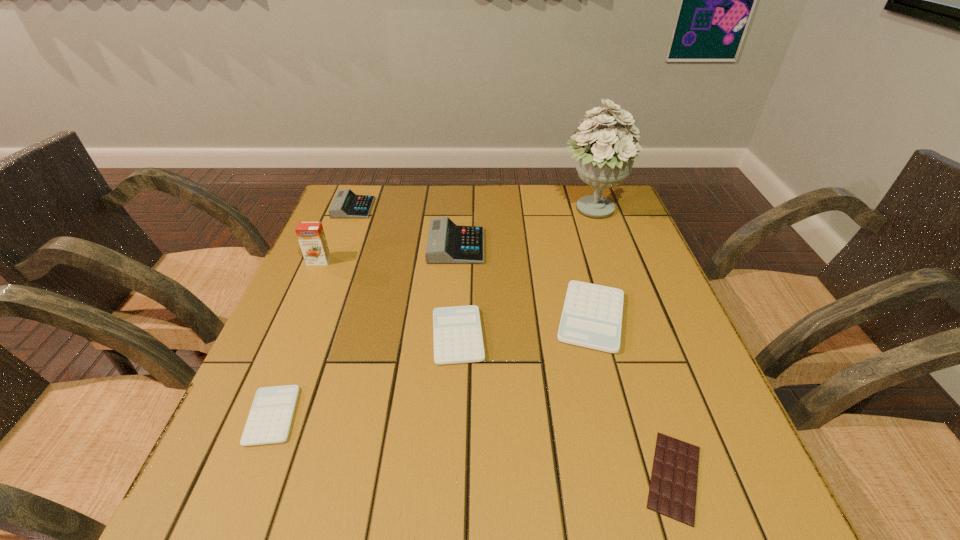
Choose which object is the nearest neighbor to the third tallest calculator. Please provide its 2D coordinates. Your answer should be formatted as a tuple, i.e. [(x, y)], where the tuple contains the x and y coordinates of a point satisfying the conditions above.

[(457, 334)]

Select which calculator appears as the fourth closest to the second white calculator from left to right. Please provide its 2D coordinates. Your answer should be formatted as a tuple, i.e. [(x, y)], where the tuple contains the x and y coordinates of a point satisfying the conditions above.

[(346, 204)]

Locate an element on the screen. calculator that is the second closest one to the leftmost white calculator is located at coordinates (448, 243).

In order to click on white calculator object that ranks as the third closest to the orange juice in this screenshot , I will do `click(592, 314)`.

Identify which white calculator is the closest to the second shortest object. Please provide its 2D coordinates. Your answer should be formatted as a tuple, i.e. [(x, y)], where the tuple contains the x and y coordinates of a point satisfying the conditions above.

[(457, 334)]

Image resolution: width=960 pixels, height=540 pixels. I want to click on vacant space that satisfies the following two spatial constraints: 1. on the front side of the orange juice; 2. on the left side of the fifth tallest object, so click(x=295, y=317).